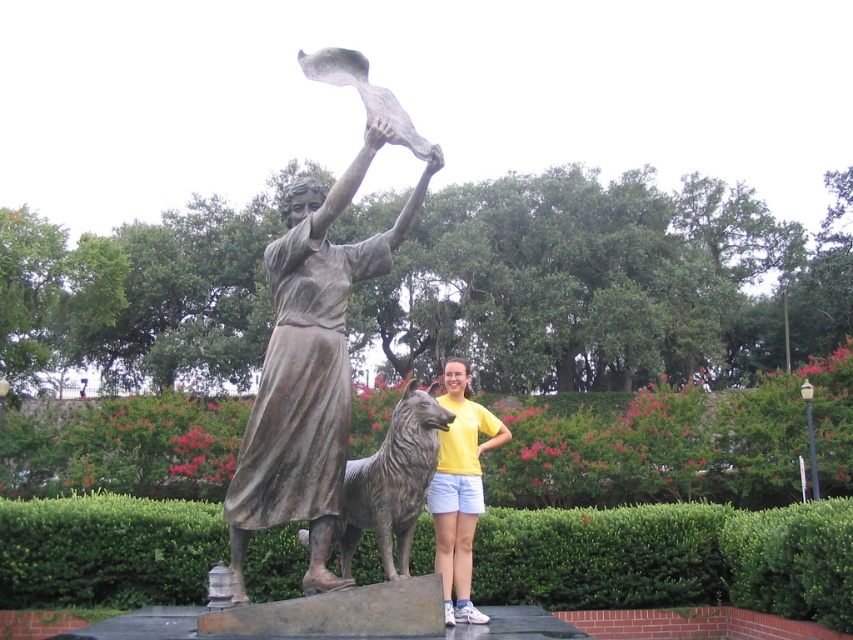
You are a photographer trying to capture a photo of the bronze statue at center and the yellow cotton shirt at center. Since you want to ensure both are in focus, you need to know which one is taller. Can you determine which object is taller?

The bronze statue at center is taller than the yellow cotton shirt at center, so you should adjust your camera settings to focus on the taller bronze statue at center first.

You are a photographer who wants to capture the bronze statue at center in the image. You notice a specific point marked at coordinates point (314, 339). Where exactly on the bronze statue at center is this point located?

The point (314, 339) is located on the bronze statue at center.